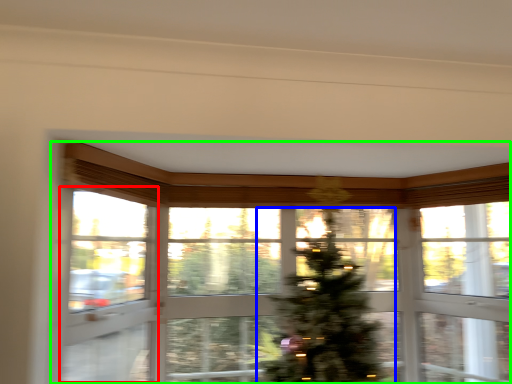
Question: Considering the real-world distances, which object is farthest from screen door (highlighted by a red box)? christmas tree (highlighted by a blue box) or window (highlighted by a green box)?

Choices:
 (A) christmas tree
 (B) window

Answer: (A)